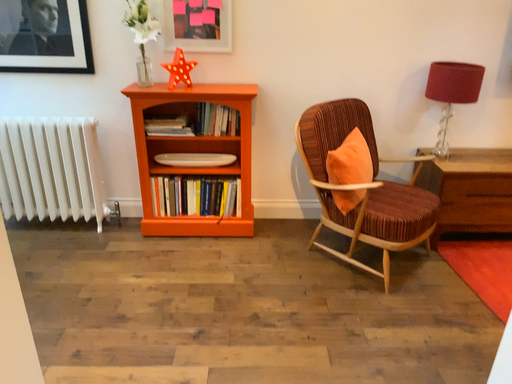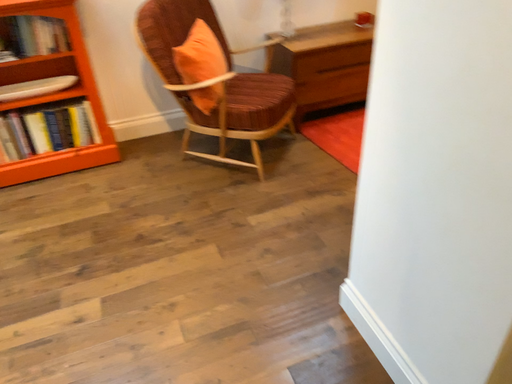
Question: Which way did the camera rotate in the video?

Choices:
 (A) rotated right
 (B) rotated left

Answer: (A)